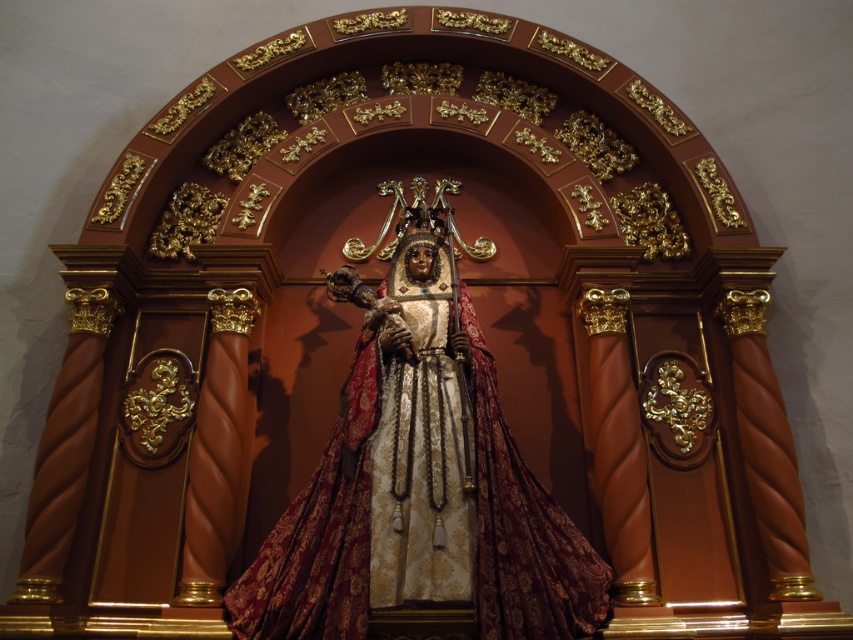
Question: Is gold plated statue at center closer to camera compared to gold textured statue at center?

Choices:
 (A) yes
 (B) no

Answer: (A)

Question: Can you confirm if gold plated statue at center is thinner than gold textured statue at center?

Choices:
 (A) yes
 (B) no

Answer: (B)

Question: Which point is closer to the camera?

Choices:
 (A) (485, 476)
 (B) (444, 566)

Answer: (B)

Question: Is gold plated statue at center to the left of gold textured statue at center from the viewer's perspective?

Choices:
 (A) yes
 (B) no

Answer: (A)

Question: Among these points, which one is farthest from the camera?

Choices:
 (A) (509, 596)
 (B) (408, 470)

Answer: (B)

Question: Which object is closer to the camera taking this photo?

Choices:
 (A) gold textured statue at center
 (B) gold plated statue at center

Answer: (B)